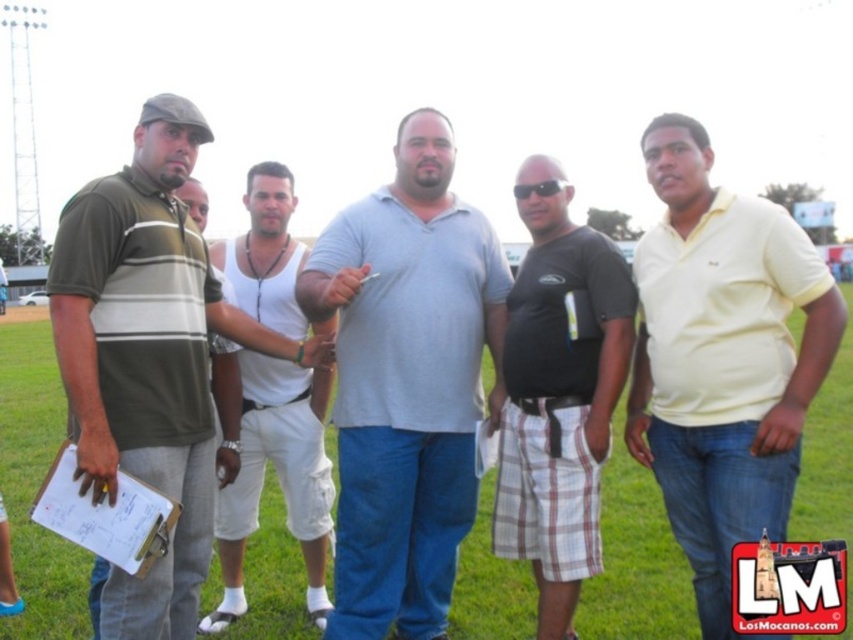
Can you confirm if black cotton t-shirt at center is taller than black plastic sunglasses at center?

Yes.

Can you confirm if black cotton t-shirt at center is thinner than black plastic sunglasses at center?

No.

Who is more distant from viewer, (x=541, y=326) or (x=544, y=192)?

The point (x=544, y=192) is behind.

Where is `black cotton t-shirt at center`? This screenshot has height=640, width=853. black cotton t-shirt at center is located at coordinates (560, 404).

Does green grass at center have a lesser height compared to black cotton t-shirt at center?

Indeed, green grass at center has a lesser height compared to black cotton t-shirt at center.

Is green grass at center to the left of black cotton t-shirt at center from the viewer's perspective?

Yes, green grass at center is to the left of black cotton t-shirt at center.

You are a GUI agent. You are given a task and a screenshot of the screen. Output one action in this format:
    pyautogui.click(x=<x>, y=<y>)
    Task: Click on the green grass at center
    
    Given the screenshot: What is the action you would take?
    pyautogui.click(x=36, y=486)

At what (x,y) coordinates should I click in order to perform the action: click on green grass at center. Please return your answer as a coordinate pair (x, y). This screenshot has height=640, width=853. Looking at the image, I should click on (36, 486).

Is green grass at center taller than black plastic sunglasses at center?

Indeed, green grass at center has a greater height compared to black plastic sunglasses at center.

Can you confirm if green grass at center is positioned above black plastic sunglasses at center?

Actually, green grass at center is below black plastic sunglasses at center.

The height and width of the screenshot is (640, 853). Describe the element at coordinates (36, 486) in the screenshot. I see `green grass at center` at that location.

Locate an element on the screen. This screenshot has height=640, width=853. green grass at center is located at coordinates (36, 486).